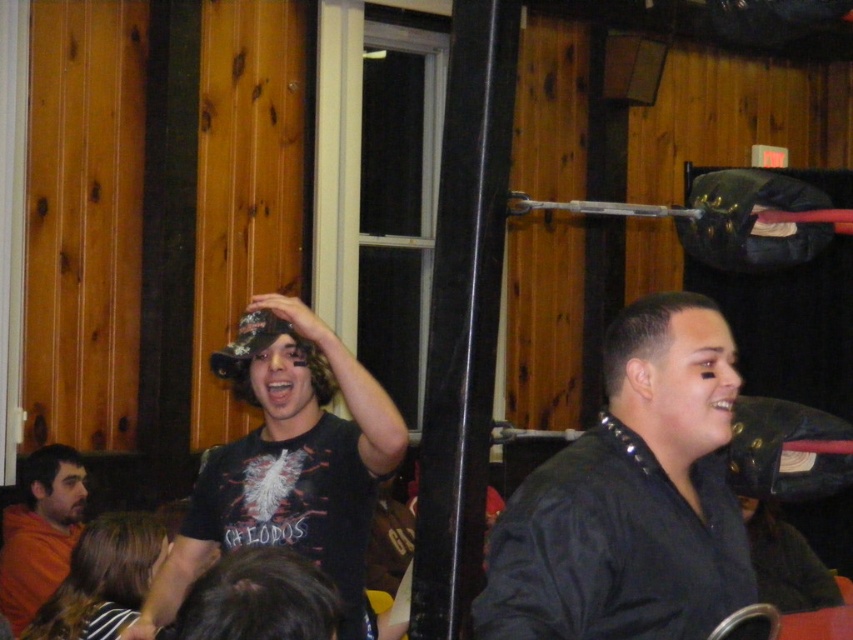
Question: Estimate the real-world distances between objects in this image. Which object is farther from the orange cotton shirt at lower left?

Choices:
 (A) black leather jacket at center
 (B) black matte cap at center

Answer: (A)

Question: Observing the image, what is the correct spatial positioning of black leather jacket at center in reference to black matte cap at center?

Choices:
 (A) left
 (B) right

Answer: (B)

Question: Is black matte cap at center wider than orange cotton shirt at lower left?

Choices:
 (A) yes
 (B) no

Answer: (A)

Question: Which of these objects is positioned closest to the black leather jacket at center?

Choices:
 (A) orange cotton shirt at lower left
 (B) black matte cap at center

Answer: (B)

Question: Considering the relative positions of black leather jacket at center and black matte cap at center in the image provided, where is black leather jacket at center located with respect to black matte cap at center?

Choices:
 (A) above
 (B) below

Answer: (A)

Question: Considering the real-world distances, which object is closest to the black leather jacket at center?

Choices:
 (A) orange cotton shirt at lower left
 (B) black matte cap at center

Answer: (B)